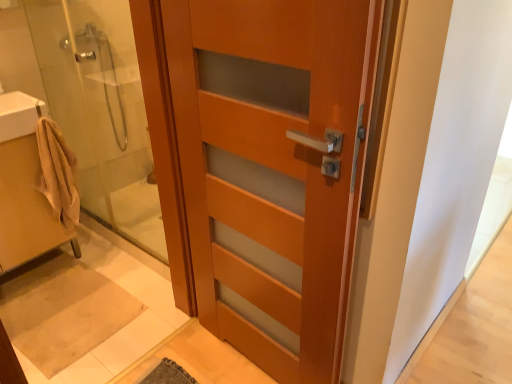
Question: Is matte wood door at center at the left side of beige fabric towel at left, arranged as the first sink when ordered from the bottom?

Choices:
 (A) yes
 (B) no

Answer: (B)

Question: Can you confirm if matte wood door at center is bigger than beige fabric towel at left, arranged as the first sink when ordered from the bottom?

Choices:
 (A) yes
 (B) no

Answer: (A)

Question: Is beige fabric towel at left, which is the 2th sink in top-to-bottom order, a part of matte wood door at center?

Choices:
 (A) no
 (B) yes

Answer: (A)

Question: Considering the relative sizes of matte wood door at center and beige fabric towel at left, arranged as the first sink when ordered from the bottom, in the image provided, is matte wood door at center shorter than beige fabric towel at left, arranged as the first sink when ordered from the bottom,?

Choices:
 (A) no
 (B) yes

Answer: (A)

Question: Is the surface of matte wood door at center in direct contact with beige fabric towel at left, which is the 2th sink in top-to-bottom order?

Choices:
 (A) yes
 (B) no

Answer: (B)

Question: In terms of size, does matte wood door at center appear bigger or smaller than matte wood door at center?

Choices:
 (A) small
 (B) big

Answer: (B)

Question: From a real-world perspective, is matte wood door at center above or below matte wood door at center?

Choices:
 (A) above
 (B) below

Answer: (A)

Question: Is point (166, 125) positioned closer to the camera than point (257, 276)?

Choices:
 (A) closer
 (B) farther

Answer: (B)

Question: Considering the relative positions of matte wood door at center and matte wood door at center in the image provided, is matte wood door at center to the left or to the right of matte wood door at center?

Choices:
 (A) right
 (B) left

Answer: (B)

Question: Considering the positions of point (249, 223) and point (42, 193), is point (249, 223) closer or farther from the camera than point (42, 193)?

Choices:
 (A) closer
 (B) farther

Answer: (A)

Question: Considering their positions, is matte wood door at center located in front of or behind beige cotton bathrobe at left?

Choices:
 (A) behind
 (B) front

Answer: (B)

Question: Considering the positions of matte wood door at center and beige cotton bathrobe at left in the image, is matte wood door at center bigger or smaller than beige cotton bathrobe at left?

Choices:
 (A) big
 (B) small

Answer: (A)

Question: Based on their positions, is matte wood door at center located to the left or right of beige cotton bathrobe at left?

Choices:
 (A) left
 (B) right

Answer: (B)

Question: Considering the positions of matte wood door at center and beige cotton bathrobe at left in the image, is matte wood door at center taller or shorter than beige cotton bathrobe at left?

Choices:
 (A) short
 (B) tall

Answer: (B)

Question: Looking at their shapes, would you say matte wood door at center is wider or thinner than beige cotton bathrobe at left?

Choices:
 (A) thin
 (B) wide

Answer: (B)